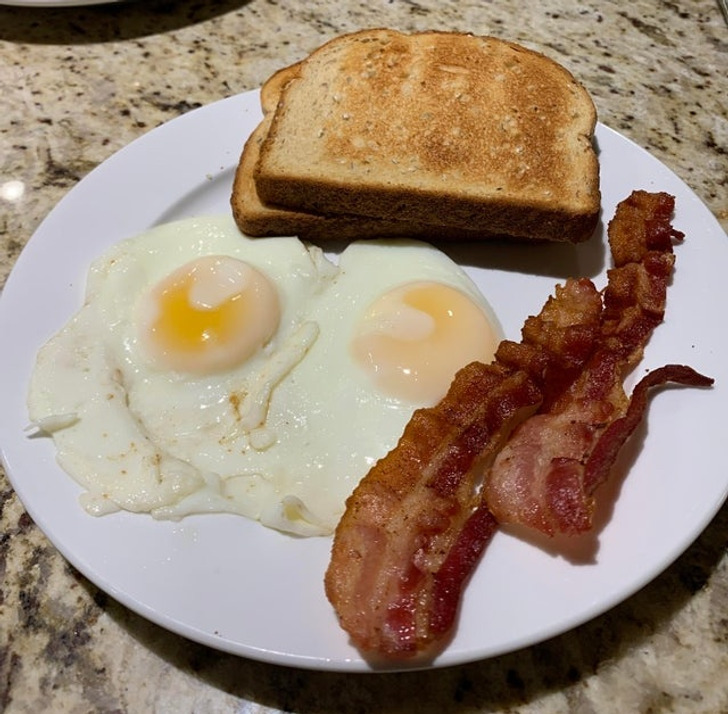
This screenshot has height=714, width=728. What are the coordinates of `table` in the screenshot? It's located at (648, 700).